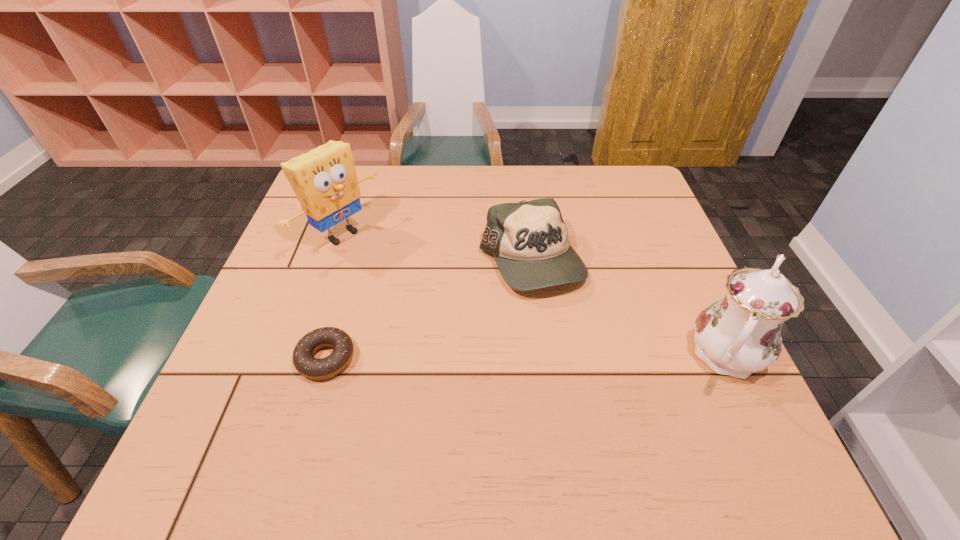
The height and width of the screenshot is (540, 960). Find the location of `the shortest object`. the shortest object is located at coordinates (306, 364).

Locate an element on the screen. Image resolution: width=960 pixels, height=540 pixels. the rightmost object is located at coordinates (740, 334).

This screenshot has height=540, width=960. In order to click on sponge in this screenshot , I will do `click(324, 180)`.

Locate an element on the screen. the second shortest object is located at coordinates (529, 240).

Identify the location of the second object from right to left. (529, 240).

You are a GUI agent. You are given a task and a screenshot of the screen. Output one action in this format:
    pyautogui.click(x=<x>, y=<y>)
    Task: Click on the vacant space located on the front of the shortest object
    
    Given the screenshot: What is the action you would take?
    pyautogui.click(x=307, y=422)

I want to click on free spot located 0.070m on the left of the chinaware, so click(x=654, y=354).

You are a GUI agent. You are given a task and a screenshot of the screen. Output one action in this format:
    pyautogui.click(x=<x>, y=<y>)
    Task: Click on the vacant space located on the face of the sponge
    The height and width of the screenshot is (540, 960).
    Given the screenshot: What is the action you would take?
    pyautogui.click(x=396, y=274)

Where is `free space located 0.140m on the face of the sponge`? free space located 0.140m on the face of the sponge is located at coordinates (401, 278).

Where is `vacant region located 0.060m on the face of the sponge`? vacant region located 0.060m on the face of the sponge is located at coordinates (380, 264).